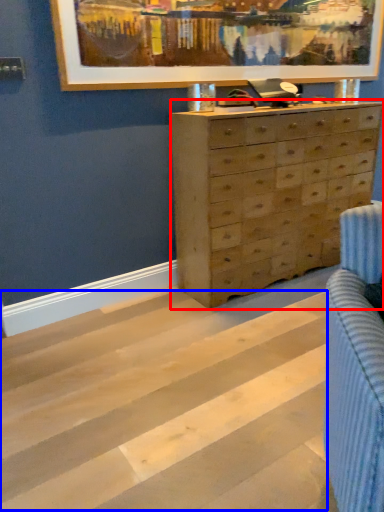
Question: Among these objects, which one is farthest to the camera, chest of drawers (highlighted by a red box) or stripe (highlighted by a blue box)?

Choices:
 (A) chest of drawers
 (B) stripe

Answer: (A)